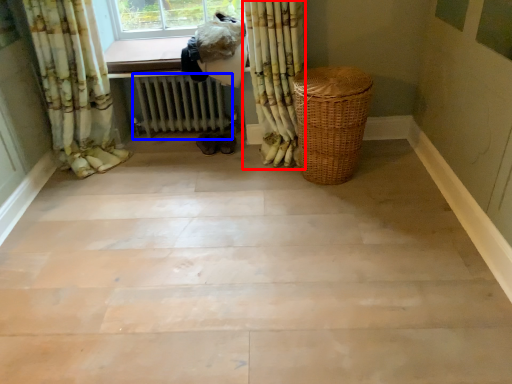
Question: Which point is further to the camera, curtain (highlighted by a red box) or radiator (highlighted by a blue box)?

Choices:
 (A) curtain
 (B) radiator

Answer: (B)